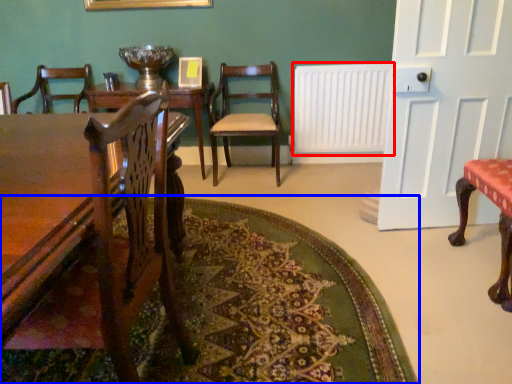
Question: Which object appears closest to the camera in this image, radiator (highlighted by a red box) or mat (highlighted by a blue box)?

Choices:
 (A) radiator
 (B) mat

Answer: (B)